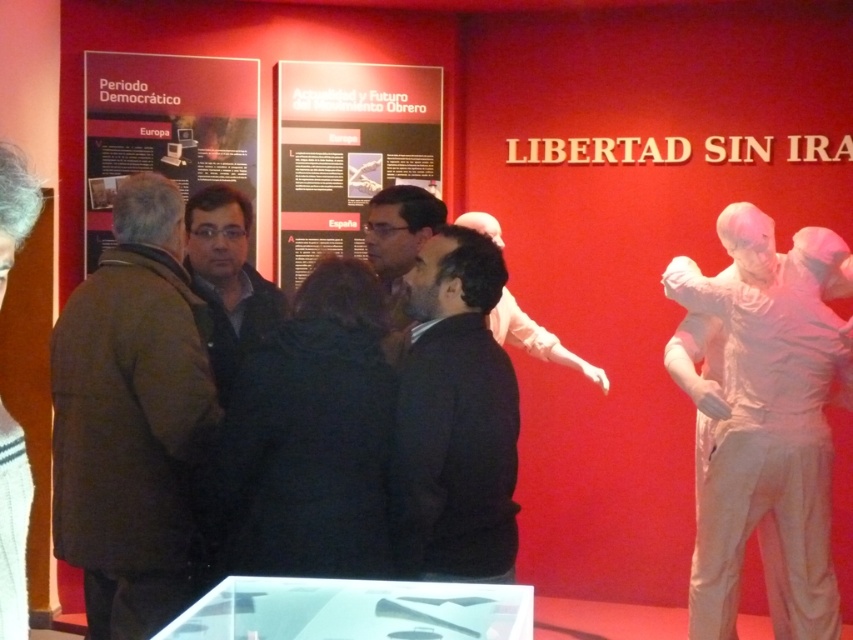
You are an art curator planning to move the white glossy statue at right and the matte black jacket at center to a new exhibition space. The new space has a narrow corridor that can only accommodate items up to 1.2 meters in width. Based on the current arrangement, can both items be moved through the corridor without needing to be altered?

The white glossy statue at right might be wider than matte black jacket at center. Since the corridor can only accommodate items up to 1.2 meters in width, it is uncertain whether the statue will fit. The jacket may fit, but the statue might exceed the width limit. Further measurement is needed to confirm.